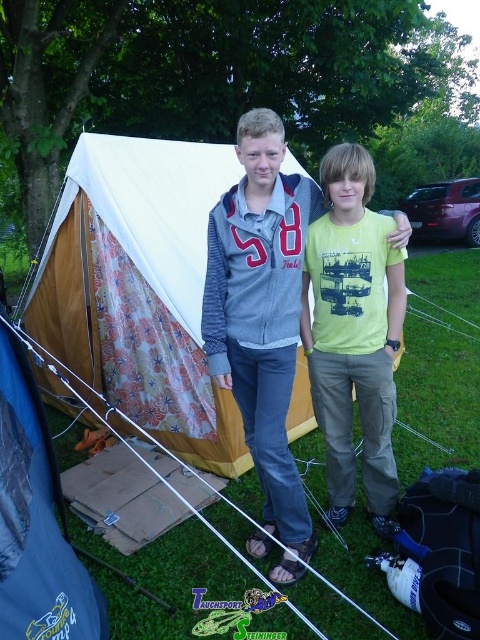
You are planning to set up a tent in your backyard and have the gray fleece jacket at center and the floral fabric tent at center. Which item is wider?

The floral fabric tent at center is wider than the gray fleece jacket at center.

What is the exact coordinate of the gray fleece jacket at center?

The gray fleece jacket at center is located at point (262, 310).